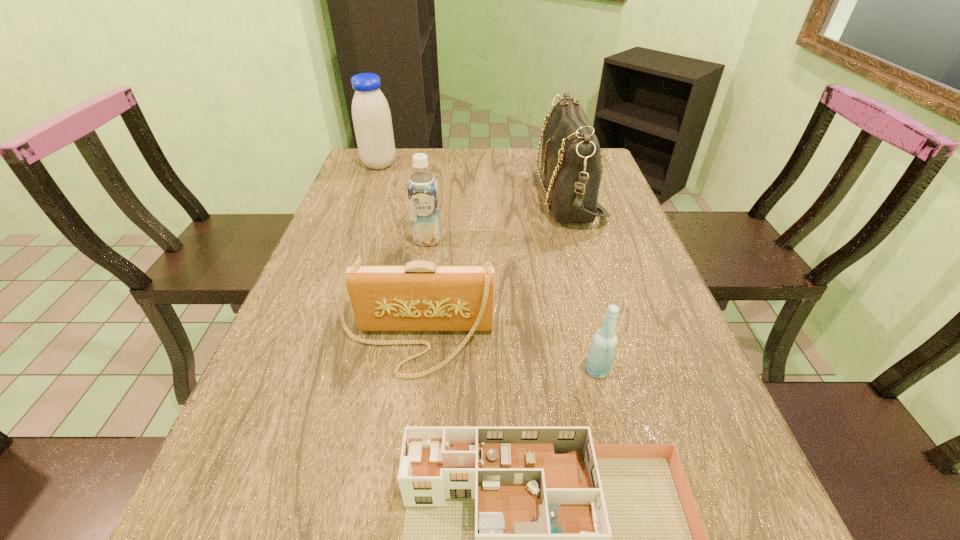
Where is `object that is positioned at the right edge`? The height and width of the screenshot is (540, 960). object that is positioned at the right edge is located at coordinates (571, 155).

Locate an element on the screen. object that is positioned at the far left corner is located at coordinates point(371,115).

This screenshot has height=540, width=960. What are the coordinates of `object at the far right corner` in the screenshot? It's located at (571, 155).

Identify the location of free space at the far edge of the desktop. The image size is (960, 540). (484, 166).

This screenshot has width=960, height=540. What are the coordinates of `vacant space at the left edge` in the screenshot? It's located at (327, 341).

The height and width of the screenshot is (540, 960). I want to click on vacant space at the right edge of the desktop, so click(x=674, y=413).

The width and height of the screenshot is (960, 540). Identify the location of vacant space at the far left corner of the desktop. (372, 181).

You are a GUI agent. You are given a task and a screenshot of the screen. Output one action in this format:
    pyautogui.click(x=<x>, y=<y>)
    Task: Click on the free spot between the right handbag and the taller soya milk
    
    Given the screenshot: What is the action you would take?
    pyautogui.click(x=473, y=180)

I want to click on vacant area between the bottle and the shorter handbag, so click(507, 356).

Image resolution: width=960 pixels, height=540 pixels. What are the coordinates of `the second closest object to the taller handbag` in the screenshot? It's located at [420, 296].